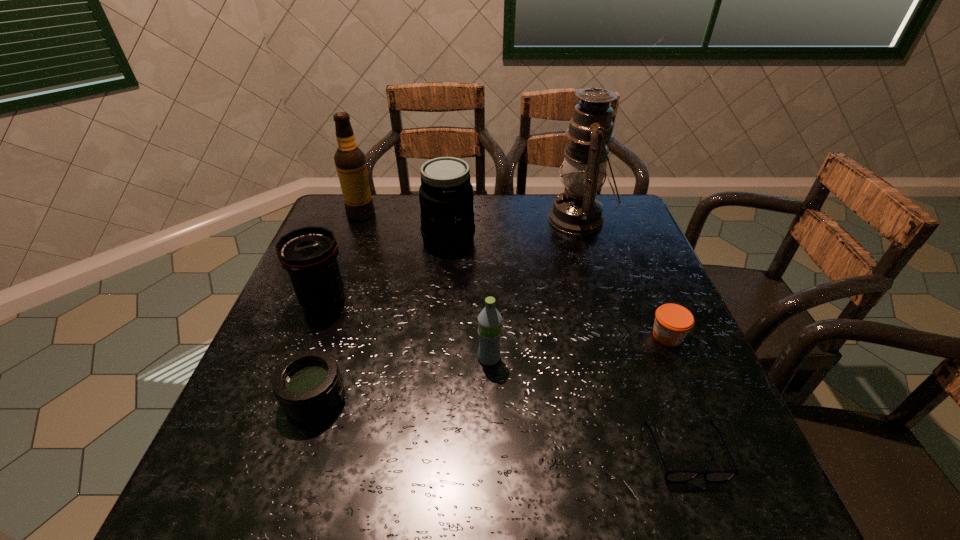
What are the coordinates of `the tallest object` in the screenshot? It's located at (577, 210).

Identify the location of the seventh shortest object. This screenshot has width=960, height=540. (350, 161).

Where is `the farthest telephoto lens`? This screenshot has width=960, height=540. the farthest telephoto lens is located at coordinates (446, 197).

Where is `the rightmost telephoto lens`? the rightmost telephoto lens is located at coordinates (446, 197).

The width and height of the screenshot is (960, 540). What are the coordinates of `the second nearest telephoto lens` in the screenshot? It's located at (309, 254).

The width and height of the screenshot is (960, 540). What are the coordinates of `the fifth nearest object` in the screenshot? It's located at pyautogui.click(x=309, y=254).

This screenshot has height=540, width=960. I want to click on water bottle, so click(x=489, y=320).

Where is `the shortest telephoto lens`? This screenshot has height=540, width=960. the shortest telephoto lens is located at coordinates (308, 385).

Where is `the sixth tallest object`? This screenshot has width=960, height=540. the sixth tallest object is located at coordinates (308, 385).

This screenshot has height=540, width=960. I want to click on jam, so click(672, 323).